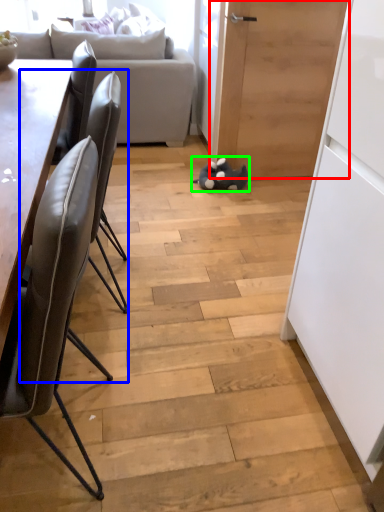
Question: Which object is the farthest from door (highlighted by a red box)? Choose among these: chair (highlighted by a blue box) or toy (highlighted by a green box).

Choices:
 (A) chair
 (B) toy

Answer: (A)